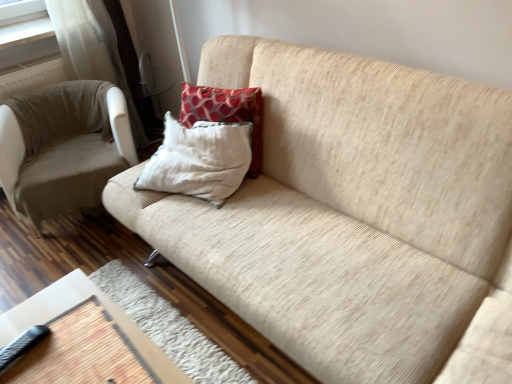
Question: Considering the relative sizes of wooden table at lower left and black rubberized remote at lower left in the image provided, is wooden table at lower left taller than black rubberized remote at lower left?

Choices:
 (A) yes
 (B) no

Answer: (A)

Question: Is wooden table at lower left to the left of black rubberized remote at lower left from the viewer's perspective?

Choices:
 (A) yes
 (B) no

Answer: (B)

Question: Considering the relative sizes of wooden table at lower left and black rubberized remote at lower left in the image provided, is wooden table at lower left shorter than black rubberized remote at lower left?

Choices:
 (A) yes
 (B) no

Answer: (B)

Question: Can you confirm if wooden table at lower left is bigger than black rubberized remote at lower left?

Choices:
 (A) no
 (B) yes

Answer: (B)

Question: Is wooden table at lower left to the right of black rubberized remote at lower left from the viewer's perspective?

Choices:
 (A) yes
 (B) no

Answer: (A)

Question: Is black rubberized remote at lower left inside wooden table at lower left?

Choices:
 (A) yes
 (B) no

Answer: (B)

Question: From the image's perspective, is beige fabric chair at left under wooden table at lower left?

Choices:
 (A) no
 (B) yes

Answer: (A)

Question: Is beige fabric chair at left wider than wooden table at lower left?

Choices:
 (A) yes
 (B) no

Answer: (B)

Question: Is beige fabric chair at left looking in the opposite direction of wooden table at lower left?

Choices:
 (A) no
 (B) yes

Answer: (A)

Question: Is beige fabric chair at left aimed at wooden table at lower left?

Choices:
 (A) yes
 (B) no

Answer: (A)

Question: Is the depth of beige fabric chair at left greater than that of wooden table at lower left?

Choices:
 (A) no
 (B) yes

Answer: (B)

Question: Does beige fabric chair at left appear on the left side of wooden table at lower left?

Choices:
 (A) yes
 (B) no

Answer: (A)

Question: Can you confirm if wooden table at lower left is wider than beige fabric chair at left?

Choices:
 (A) no
 (B) yes

Answer: (B)